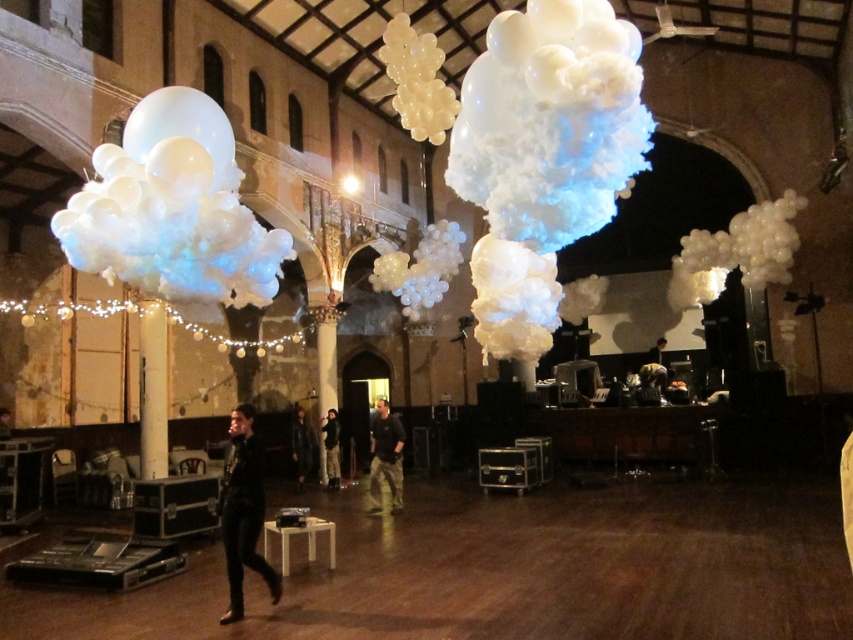
Does matte white cloud at left have a larger size compared to leather jacket at center?

Incorrect, matte white cloud at left is not larger than leather jacket at center.

Describe the element at coordinates (173, 209) in the screenshot. I see `matte white cloud at left` at that location.

Which is behind, point (169, 269) or point (297, 451)?

Positioned behind is point (297, 451).

The height and width of the screenshot is (640, 853). In order to click on matte white cloud at left in this screenshot , I will do `click(173, 209)`.

Based on the photo, does black matte clothing at center have a greater width compared to dark gray jacket at center?

No.

Which is above, black matte clothing at center or dark gray jacket at center?

black matte clothing at center is above.

What do you see at coordinates (242, 513) in the screenshot?
I see `black matte clothing at center` at bounding box center [242, 513].

The image size is (853, 640). Find the location of `black matte clothing at center`. black matte clothing at center is located at coordinates (242, 513).

Who is shorter, white cloud at right or dark brown leather jacket at center?

dark brown leather jacket at center

Which is behind, point (752, 241) or point (374, 420)?

The point (752, 241) is behind.

What are the coordinates of `white cloud at right` in the screenshot? It's located at (735, 252).

You are a GUI agent. You are given a task and a screenshot of the screen. Output one action in this format:
    pyautogui.click(x=<x>, y=<y>)
    Task: Click on the white cloud at right
    This screenshot has width=853, height=640.
    Given the screenshot: What is the action you would take?
    pyautogui.click(x=735, y=252)